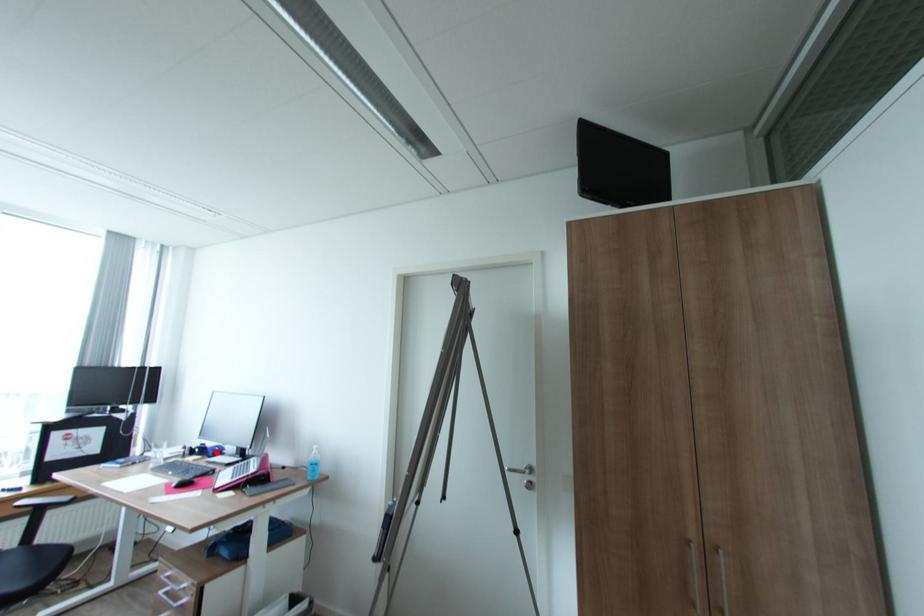
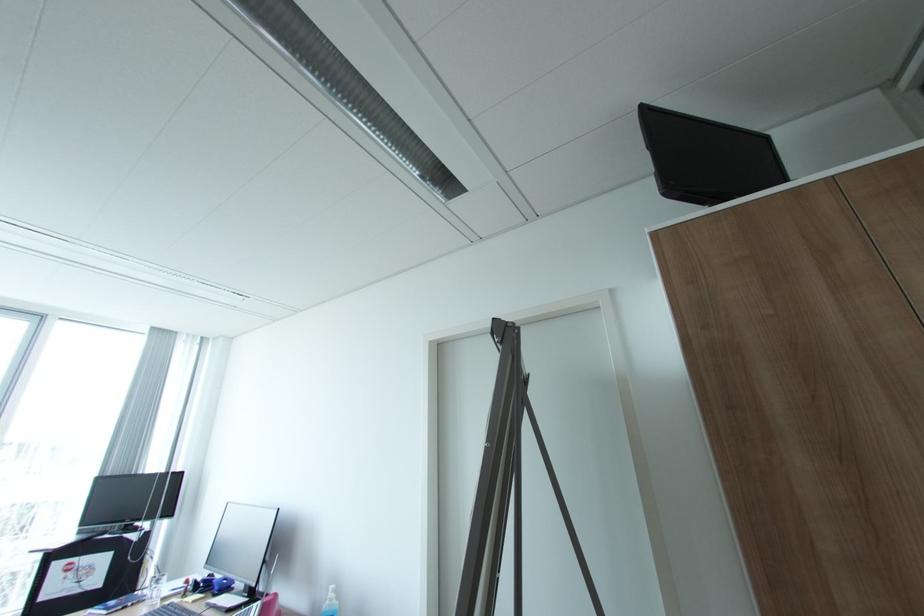
Find the pixel in the second image that matches the highlighted location in the first image.

(222, 588)